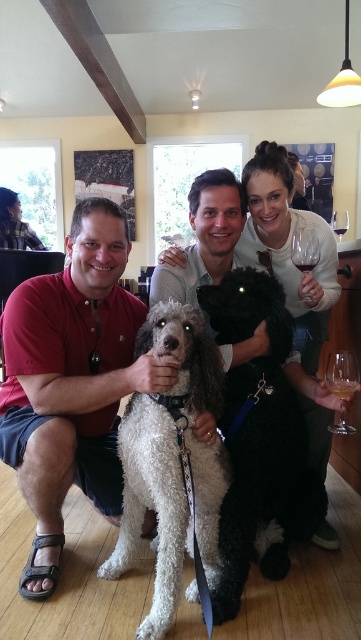
Question: Among these points, which one is farthest from the camera?

Choices:
 (A) (332, 241)
 (B) (284, 442)
 (C) (340, 227)

Answer: (C)

Question: Based on their relative distances, which object is farther from the white fluffy dog at center?

Choices:
 (A) clear glass at lower right
 (B) clear glass wine glass at lower right
 (C) matte red shirt at center
 (D) dark red glass at upper center

Answer: (D)

Question: Can you confirm if clear glass at lower right is thinner than transparent glass wine glass at upper right?

Choices:
 (A) no
 (B) yes

Answer: (B)

Question: Considering the real-world distances, which object is farthest from the clear glass at lower right?

Choices:
 (A) transparent glass at upper right
 (B) shiny black dog at center
 (C) black fuzzy dog at center
 (D) white fluffy dog at center

Answer: (A)

Question: Can you confirm if transparent glass wine at upper right is positioned to the left of clear glass at lower right?

Choices:
 (A) no
 (B) yes

Answer: (B)

Question: Does shiny black dog at center appear on the right side of clear glass wine glass at lower right?

Choices:
 (A) yes
 (B) no

Answer: (B)